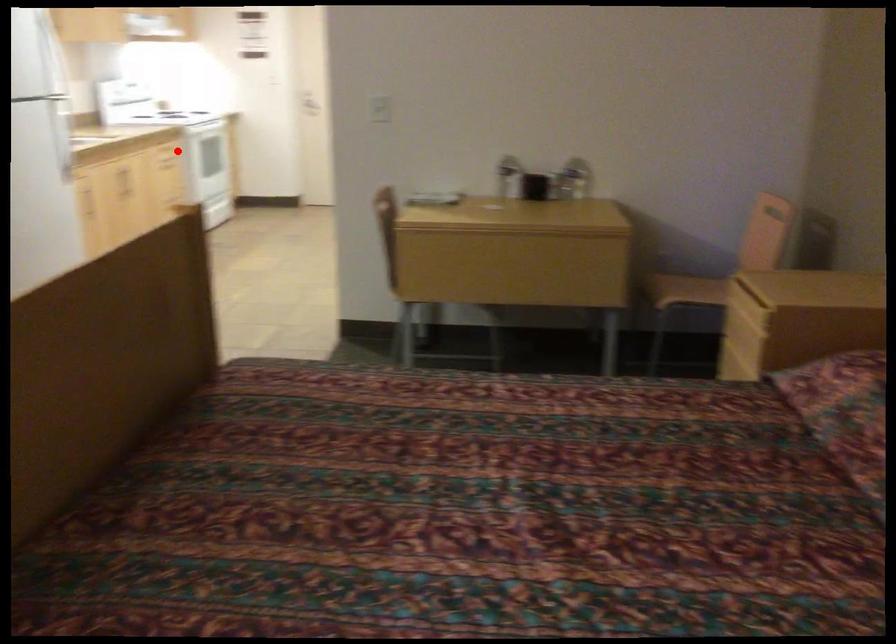
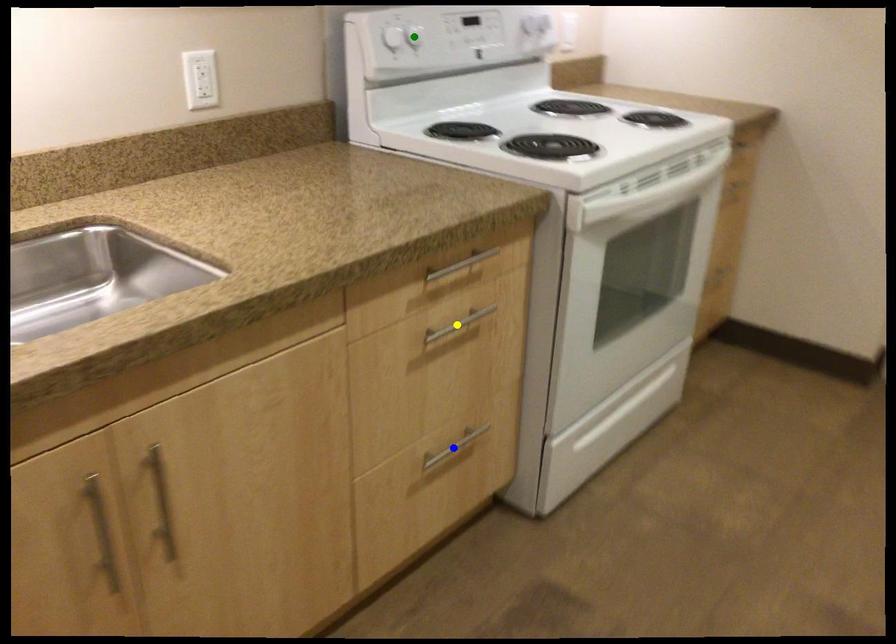
Question: I am providing you with two images of the same scene from different viewpoints. A red point is marked on the first image. You are given multiple points on the second image. Which point in image 2 is actually the same real-world point as the red point in image 1?

Choices:
 (A) green point
 (B) blue point
 (C) yellow point

Answer: (C)